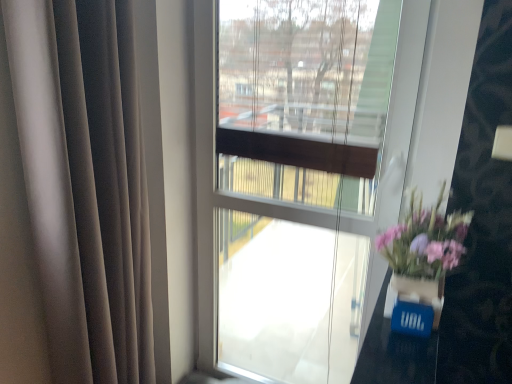
Question: In the image, is purple floral bouquet at right on the left side or the right side of blue matte glass vase at lower right?

Choices:
 (A) left
 (B) right

Answer: (B)

Question: Based on their sizes in the image, would you say purple floral bouquet at right is bigger or smaller than blue matte glass vase at lower right?

Choices:
 (A) small
 (B) big

Answer: (B)

Question: Considering the positions of point (418, 304) and point (437, 284), is point (418, 304) closer or farther from the camera than point (437, 284)?

Choices:
 (A) farther
 (B) closer

Answer: (B)

Question: Looking at their shapes, would you say blue matte glass vase at lower right is wider or thinner than purple floral bouquet at right?

Choices:
 (A) wide
 (B) thin

Answer: (B)

Question: Is point (388, 296) positioned closer to the camera than point (386, 253)?

Choices:
 (A) farther
 (B) closer

Answer: (B)

Question: Is blue matte glass vase at lower right spatially inside purple floral bouquet at right, or outside of it?

Choices:
 (A) outside
 (B) inside

Answer: (A)

Question: From a real-world perspective, is blue matte glass vase at lower right positioned above or below purple floral bouquet at right?

Choices:
 (A) below
 (B) above

Answer: (A)